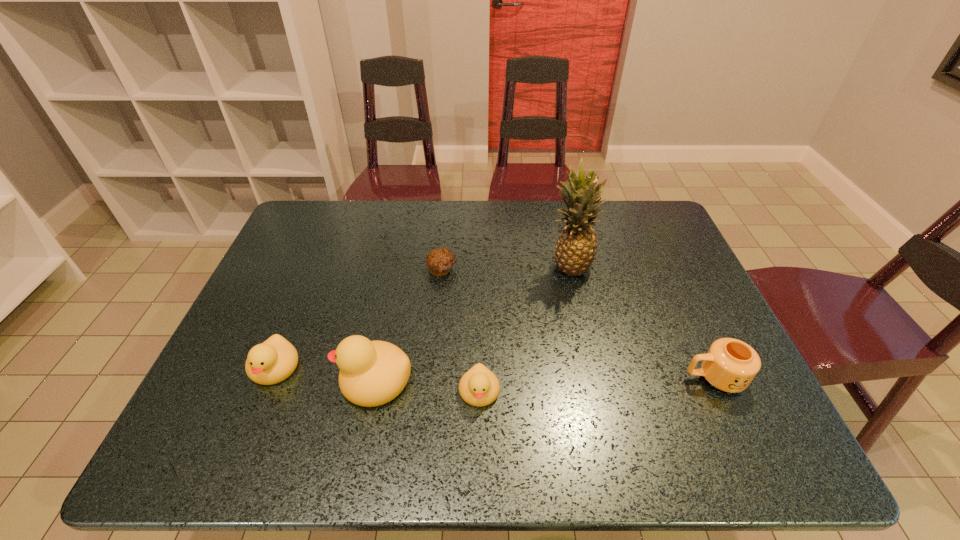
Find the location of `the leftmost object`. the leftmost object is located at coordinates (273, 361).

Where is `the second shortest duckling`? Image resolution: width=960 pixels, height=540 pixels. the second shortest duckling is located at coordinates (273, 361).

What are the coordinates of `the second duckling from left to right` in the screenshot? It's located at (372, 373).

You are a GUI agent. You are given a task and a screenshot of the screen. Output one action in this format:
    pyautogui.click(x=<x>, y=<y>)
    Task: Click on the tallest duckling
    
    Given the screenshot: What is the action you would take?
    pyautogui.click(x=372, y=373)

Find the location of `the fifth tallest object`. the fifth tallest object is located at coordinates (479, 386).

Find the location of `the fourth object from left to right`. the fourth object from left to right is located at coordinates (479, 386).

This screenshot has width=960, height=540. In order to click on pineapple in this screenshot , I will do `click(576, 247)`.

Locate an element on the screen. The height and width of the screenshot is (540, 960). the tallest object is located at coordinates (576, 247).

Locate an element on the screen. Image resolution: width=960 pixels, height=540 pixels. the shortest object is located at coordinates (440, 261).

Locate an element on the screen. The height and width of the screenshot is (540, 960). the rightmost object is located at coordinates (730, 365).